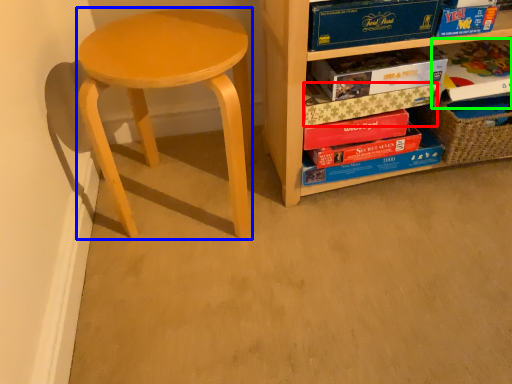
Question: Considering the real-world distances, which object is closest to paperback book (highlighted by a red box)? stool (highlighted by a blue box) or paperback book (highlighted by a green box).

Choices:
 (A) stool
 (B) paperback book

Answer: (B)